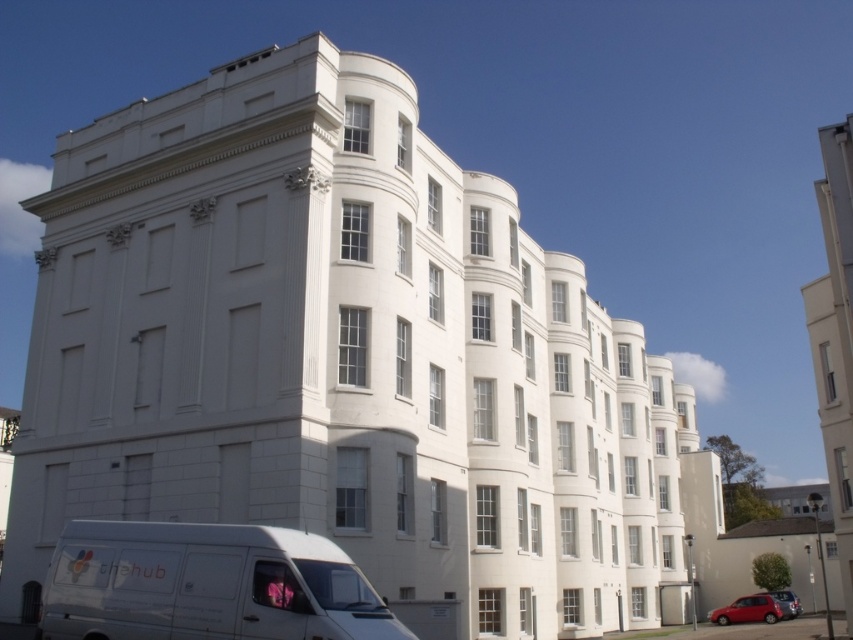
Does white matte van at lower left appear over metallic silver car at lower right?

Yes, white matte van at lower left is above metallic silver car at lower right.

Who is more distant from viewer, (73, 611) or (782, 593)?

The point (782, 593) is behind.

This screenshot has height=640, width=853. Identify the location of white matte van at lower left. (206, 584).

Between point (758, 605) and point (780, 596), which one is positioned in front?

Point (758, 605) is more forward.

Is shiny red car at lower right positioned in front of metallic silver car at lower right?

Yes, it is.

Is point (770, 604) more distant than point (782, 602)?

That is False.

At what (x,y) coordinates should I click in order to perform the action: click on shiny red car at lower right. Please return your answer as a coordinate pair (x, y). Looking at the image, I should click on pos(750,611).

Does white matte van at lower left lie behind shiny red car at lower right?

No, it is not.

Between white matte van at lower left and shiny red car at lower right, which one is positioned lower?

shiny red car at lower right

Is point (215, 540) positioned after point (746, 596)?

No, it is in front of (746, 596).

Locate an element on the screen. This screenshot has height=640, width=853. white matte van at lower left is located at coordinates [206, 584].